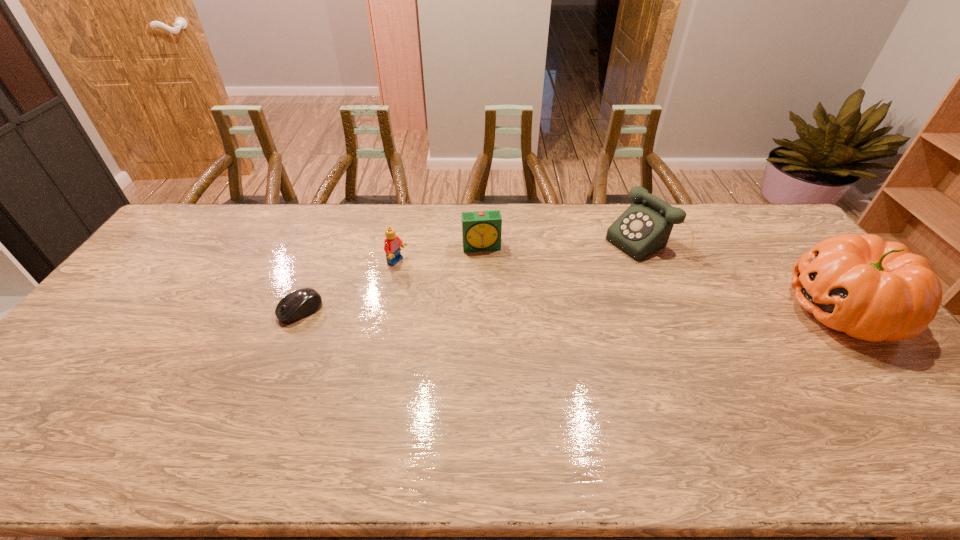
Identify the location of vacant area located on the carved face of the rightmost object. The width and height of the screenshot is (960, 540). (705, 310).

Locate an element on the screen. The height and width of the screenshot is (540, 960). vacant area located 0.390m on the carved face of the rightmost object is located at coordinates (654, 310).

This screenshot has width=960, height=540. I want to click on blank space located on the front-facing side of the third object from left to right, so click(x=491, y=293).

Locate an element on the screen. free space located on the front-facing side of the third object from left to right is located at coordinates (492, 302).

The height and width of the screenshot is (540, 960). What are the coordinates of `vacant position located on the front-facing side of the third object from left to right` in the screenshot? It's located at (493, 307).

You are a GUI agent. You are given a task and a screenshot of the screen. Output one action in this format:
    pyautogui.click(x=<x>, y=<y>)
    Task: Click on the free location located 0.190m on the dial of the fourth object from left to right
    The height and width of the screenshot is (540, 960).
    Given the screenshot: What is the action you would take?
    pyautogui.click(x=576, y=280)

At what (x,y) coordinates should I click in order to perform the action: click on free region located 0.090m on the dial of the fourth object from left to right. Please return your answer as a coordinate pair (x, y). The height and width of the screenshot is (540, 960). Looking at the image, I should click on (599, 268).

I want to click on free space located 0.280m on the dial of the fourth object from left to right, so click(x=555, y=291).

Where is `vacant space positioned on the face of the fourth object from right to left`? vacant space positioned on the face of the fourth object from right to left is located at coordinates (431, 278).

Locate an element on the screen. Image resolution: width=960 pixels, height=540 pixels. free space located 0.380m on the face of the fourth object from right to left is located at coordinates (510, 312).